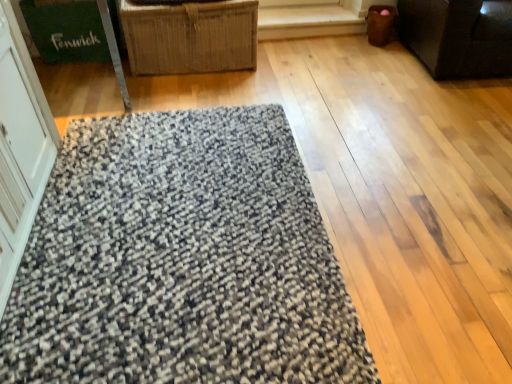
Question: Is textured gray mat at center turned away from woven straw basket at upper center, which ranks as the second furniture in right-to-left order?

Choices:
 (A) yes
 (B) no

Answer: (A)

Question: From a real-world perspective, is textured gray mat at center on top of woven straw basket at upper center, which ranks as the second furniture in right-to-left order?

Choices:
 (A) yes
 (B) no

Answer: (B)

Question: Can you confirm if textured gray mat at center is bigger than woven straw basket at upper center, which is counted as the first furniture, starting from the left?

Choices:
 (A) yes
 (B) no

Answer: (B)

Question: Does textured gray mat at center turn towards woven straw basket at upper center, which is counted as the first furniture, starting from the left?

Choices:
 (A) yes
 (B) no

Answer: (B)

Question: Is textured gray mat at center taller than woven straw basket at upper center, which is counted as the first furniture, starting from the left?

Choices:
 (A) yes
 (B) no

Answer: (B)

Question: Looking at their shapes, would you say green cardboard box at upper left is wider or thinner than textured gray mat at center?

Choices:
 (A) wide
 (B) thin

Answer: (B)

Question: From a real-world perspective, is green cardboard box at upper left physically located above or below textured gray mat at center?

Choices:
 (A) above
 (B) below

Answer: (A)

Question: Is point (95, 6) closer or farther from the camera than point (195, 178)?

Choices:
 (A) farther
 (B) closer

Answer: (A)

Question: Based on their sizes in the image, would you say green cardboard box at upper left is bigger or smaller than textured gray mat at center?

Choices:
 (A) big
 (B) small

Answer: (B)

Question: Is green cardboard box at upper left in front of or behind woven straw basket at upper center, which is counted as the first furniture, starting from the left, in the image?

Choices:
 (A) behind
 (B) front

Answer: (A)

Question: Which is correct: green cardboard box at upper left is inside woven straw basket at upper center, which ranks as the second furniture in right-to-left order, or outside of it?

Choices:
 (A) inside
 (B) outside

Answer: (B)

Question: Considering the positions of green cardboard box at upper left and woven straw basket at upper center, which is counted as the first furniture, starting from the left, in the image, is green cardboard box at upper left wider or thinner than woven straw basket at upper center, which is counted as the first furniture, starting from the left,?

Choices:
 (A) thin
 (B) wide

Answer: (A)

Question: In the image, is green cardboard box at upper left on the left side or the right side of woven straw basket at upper center, which is counted as the first furniture, starting from the left?

Choices:
 (A) right
 (B) left

Answer: (B)

Question: Is point (28, 142) positioned closer to the camera than point (123, 344)?

Choices:
 (A) closer
 (B) farther

Answer: (B)

Question: Choose the correct answer: Is white glossy screen door at left inside textured gray mat at center or outside it?

Choices:
 (A) outside
 (B) inside

Answer: (A)